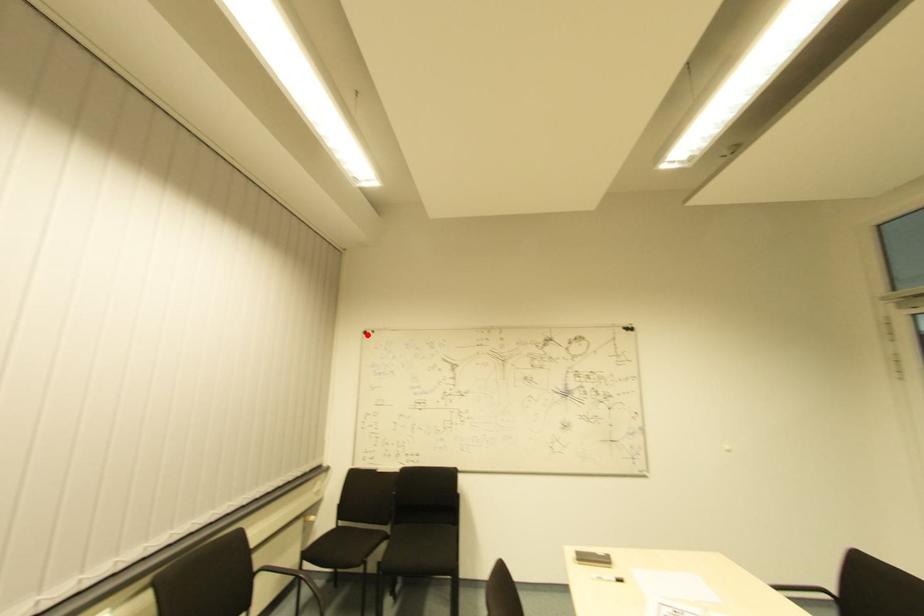
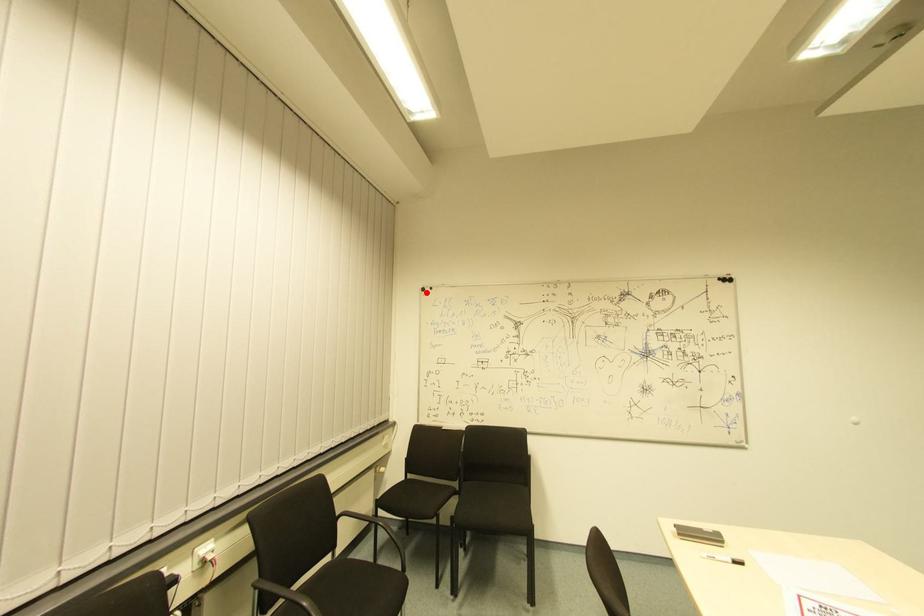
I am providing you with two images of the same scene from different viewpoints. A red point is marked on the first image and another point is marked on the second image. Does the point marked in image1 correspond to the same location as the one in image2?

Yes